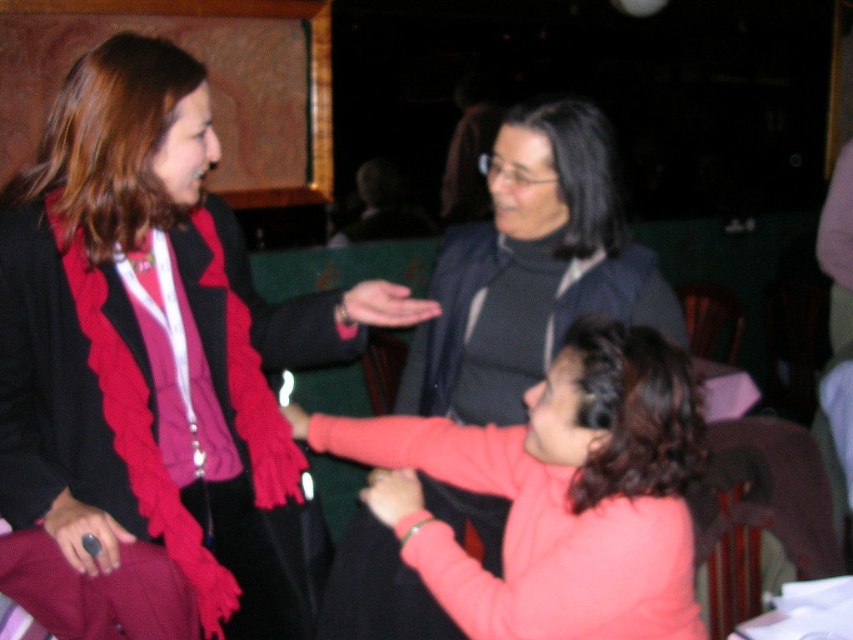
Who is shorter, matte black jacket at center or matte pink sweater at center?

matte pink sweater at center

Which is above, matte black jacket at center or matte pink sweater at center?

Positioned higher is matte black jacket at center.

This screenshot has width=853, height=640. What do you see at coordinates (154, 342) in the screenshot?
I see `matte black jacket at center` at bounding box center [154, 342].

Where is `matte black jacket at center`? The width and height of the screenshot is (853, 640). matte black jacket at center is located at coordinates (x=154, y=342).

Is pink fleece sweater at center below matte pink sweater at center?

No, pink fleece sweater at center is not below matte pink sweater at center.

Who is shorter, pink fleece sweater at center or matte pink sweater at center?

With less height is matte pink sweater at center.

This screenshot has height=640, width=853. Describe the element at coordinates (560, 493) in the screenshot. I see `pink fleece sweater at center` at that location.

At what (x,y) coordinates should I click in order to perform the action: click on pink fleece sweater at center. Please return your answer as a coordinate pair (x, y). Looking at the image, I should click on (560, 493).

Is matte black jacket at center above pink fleece sweater at center?

Indeed, matte black jacket at center is positioned over pink fleece sweater at center.

Who is shorter, matte black jacket at center or pink fleece sweater at center?

pink fleece sweater at center

Which is in front, point (62, 353) or point (393, 528)?

Point (62, 353)

Where is `matte black jacket at center`? Image resolution: width=853 pixels, height=640 pixels. matte black jacket at center is located at coordinates (154, 342).